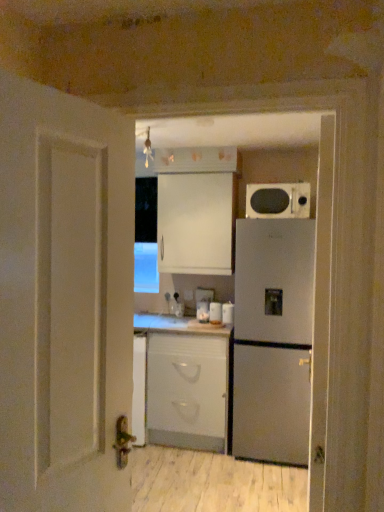
The width and height of the screenshot is (384, 512). Describe the element at coordinates (186, 382) in the screenshot. I see `white matte cabinet at center, which is the 1th cabinetry from bottom to top` at that location.

Find the location of `white glossy jar at center, the 1th appliance viewed from the left`. white glossy jar at center, the 1th appliance viewed from the left is located at coordinates (202, 311).

Image resolution: width=384 pixels, height=512 pixels. What do you see at coordinates (196, 223) in the screenshot?
I see `white matte cabinet at upper center, positioned as the first cabinetry in top-to-bottom order` at bounding box center [196, 223].

Where is `white glossy canister at center, which is counted as the 3th appliance, starting from the left`? white glossy canister at center, which is counted as the 3th appliance, starting from the left is located at coordinates (228, 313).

You are a GUI agent. You are given a task and a screenshot of the screen. Output one action in this format:
    pyautogui.click(x=<x>, y=<y>)
    Task: Click on the satin silver refrigerator at right
    
    Given the screenshot: What is the action you would take?
    pyautogui.click(x=273, y=339)

In the scene shown: Is white matte cabinet at upper center, arranged as the second cabinetry when ordered from the bottom, taller than white glossy canister at center, which is counted as the 3th appliance, starting from the left?

Yes, white matte cabinet at upper center, arranged as the second cabinetry when ordered from the bottom, is taller than white glossy canister at center, which is counted as the 3th appliance, starting from the left.

Is white matte cabinet at upper center, arranged as the second cabinetry when ordered from the bottom, to the right of white glossy canister at center, which is counted as the 3th appliance, starting from the left, from the viewer's perspective?

Incorrect, white matte cabinet at upper center, arranged as the second cabinetry when ordered from the bottom, is not on the right side of white glossy canister at center, which is counted as the 3th appliance, starting from the left.

Is white matte cabinet at upper center, positioned as the first cabinetry in top-to-bottom order, not near white glossy canister at center, which is the first appliance in right-to-left order?

That's not correct — white matte cabinet at upper center, positioned as the first cabinetry in top-to-bottom order, is a little close to white glossy canister at center, which is the first appliance in right-to-left order.

Would you say matte black microwave at upper right contains white glossy jar at center, the 1th appliance viewed from the left?

No, white glossy jar at center, the 1th appliance viewed from the left, is not surrounded by matte black microwave at upper right.

Between matte black microwave at upper right and white glossy jar at center, which is the third appliance in right-to-left order, which one has less height?

white glossy jar at center, which is the third appliance in right-to-left order.

Is matte black microwave at upper right oriented away from white glossy jar at center, the 1th appliance viewed from the left?

No, matte black microwave at upper right is not facing away from white glossy jar at center, the 1th appliance viewed from the left.

Is white matte cabinet at upper center, arranged as the second cabinetry when ordered from the bottom, smaller than matte black microwave at upper right?

No.

Does point (228, 234) come in front of point (291, 187)?

No, it is behind (291, 187).

From the image's perspective, which one is positioned higher, white matte cabinet at upper center, positioned as the first cabinetry in top-to-bottom order, or matte black microwave at upper right?

matte black microwave at upper right, from the image's perspective.

Considering the sizes of white matte cabinet at upper center, positioned as the first cabinetry in top-to-bottom order, and matte black microwave at upper right in the image, is white matte cabinet at upper center, positioned as the first cabinetry in top-to-bottom order, wider or thinner than matte black microwave at upper right?

In the image, white matte cabinet at upper center, positioned as the first cabinetry in top-to-bottom order, appears to be wider than matte black microwave at upper right.

Is white glossy jar at center, which is the third appliance in right-to-left order, not near satin silver refrigerator at right?

They are positioned close to each other.

Between white glossy jar at center, which is the third appliance in right-to-left order, and satin silver refrigerator at right, which one has less height?

Standing shorter between the two is white glossy jar at center, which is the third appliance in right-to-left order.

Is white glossy jar at center, which is the third appliance in right-to-left order, positioned beyond the bounds of satin silver refrigerator at right?

That's correct, white glossy jar at center, which is the third appliance in right-to-left order, is outside of satin silver refrigerator at right.

From the image's perspective, is white glossy jar at center, the 1th appliance viewed from the left, above or below satin silver refrigerator at right?

white glossy jar at center, the 1th appliance viewed from the left, is above satin silver refrigerator at right.

Between point (221, 411) and point (297, 186), which one is positioned in front?

The point (297, 186) is closer.

Does white matte cabinet at center, which is the 1th cabinetry from bottom to top, contain matte black microwave at upper right?

Definitely not — matte black microwave at upper right is not inside white matte cabinet at center, which is the 1th cabinetry from bottom to top.

The height and width of the screenshot is (512, 384). Identify the location of the 2nd cabinetry to the left of the matte black microwave at upper right, starting your count from the anchor. (186, 382).

What's the angular difference between white matte cabinet at center, which is the 1th cabinetry from bottom to top, and matte black microwave at upper right's facing directions?

The angle between the facing direction of white matte cabinet at center, which is the 1th cabinetry from bottom to top, and the facing direction of matte black microwave at upper right is 2.76 degrees.

Considering the relative sizes of white glossy jar at center, which is the third appliance in right-to-left order, and white glossy canister at center, which is the first appliance in right-to-left order, in the image provided, is white glossy jar at center, which is the third appliance in right-to-left order, bigger than white glossy canister at center, which is the first appliance in right-to-left order,?

Yes, white glossy jar at center, which is the third appliance in right-to-left order, is bigger than white glossy canister at center, which is the first appliance in right-to-left order.

Can you confirm if white glossy jar at center, the 1th appliance viewed from the left, is shorter than white glossy canister at center, which is the first appliance in right-to-left order?

No, white glossy jar at center, the 1th appliance viewed from the left, is not shorter than white glossy canister at center, which is the first appliance in right-to-left order.

Is white glossy jar at center, the 1th appliance viewed from the left, far from white glossy canister at center, which is the first appliance in right-to-left order?

No.

Is white glossy jar at center, which is the third appliance in right-to-left order, at the right side of white glossy canister at center, which is counted as the 3th appliance, starting from the left?

Incorrect, white glossy jar at center, which is the third appliance in right-to-left order, is not on the right side of white glossy canister at center, which is counted as the 3th appliance, starting from the left.

Consider the image. Which point is more forward, (213,191) or (218,313)?

The point (213,191) is in front.

Does white matte cabinet at upper center, positioned as the first cabinetry in top-to-bottom order, come behind white glossy jar at center, the 2th appliance positioned from the right?

No, it is in front of white glossy jar at center, the 2th appliance positioned from the right.

Which cabinetry is the 1st one when counting from the left side of the white glossy canister at center, which is counted as the 3th appliance, starting from the left? Please provide its 2D coordinates.

[(196, 223)]

Identify the location of appliance that is the 1st object directly below the matte black microwave at upper right (from a real-world perspective). pyautogui.click(x=202, y=311).

Looking at this image, based on their spatial positions, is white matte cabinet at center, which is the 1th cabinetry from bottom to top, or white matte cabinet at upper center, arranged as the second cabinetry when ordered from the bottom, closer to white glossy canister at center, which is counted as the 3th appliance, starting from the left?

The object closer to white glossy canister at center, which is counted as the 3th appliance, starting from the left, is white matte cabinet at center, which is the 1th cabinetry from bottom to top.

Considering their positions, is white glossy jar at center, marked as the 2th appliance in a left-to-right arrangement, positioned closer to satin silver refrigerator at right than matte black microwave at upper right?

matte black microwave at upper right is positioned closer to the anchor satin silver refrigerator at right.

Based on their spatial positions, is matte black microwave at upper right or white glossy canister at center, which is the first appliance in right-to-left order, closer to satin silver refrigerator at right?

white glossy canister at center, which is the first appliance in right-to-left order, is closer to satin silver refrigerator at right.

From the image, which object appears to be farther from white glossy jar at center, which is the third appliance in right-to-left order, white matte cabinet at center, which ranks as the 2th cabinetry in top-to-bottom order, or matte black microwave at upper right?

matte black microwave at upper right.

Looking at the image, which one is located closer to white matte cabinet at upper center, positioned as the first cabinetry in top-to-bottom order, white glossy jar at center, the 2th appliance positioned from the right, or matte black microwave at upper right?

matte black microwave at upper right.

When comparing their distances from white glossy canister at center, which is the first appliance in right-to-left order, does white glossy jar at center, which is the third appliance in right-to-left order, or satin silver refrigerator at right seem further?

satin silver refrigerator at right.

Consider the image. From the image, which object appears to be nearer to white glossy canister at center, which is the first appliance in right-to-left order, satin silver refrigerator at right or white matte cabinet at center, which is the 1th cabinetry from bottom to top?

Among the two, satin silver refrigerator at right is located nearer to white glossy canister at center, which is the first appliance in right-to-left order.

Which object lies nearer to the anchor point matte black microwave at upper right, satin silver refrigerator at right or white glossy jar at center, the 2th appliance positioned from the right?

Based on the image, satin silver refrigerator at right appears to be nearer to matte black microwave at upper right.

Identify the location of appliance between satin silver refrigerator at right and white glossy jar at center, the 2th appliance positioned from the right, in the front-back direction. (228, 313).

Locate an element on the screen. refrigerator between matte black microwave at upper right and white matte cabinet at center, which ranks as the 2th cabinetry in top-to-bottom order, from top to bottom is located at coordinates (273, 339).

You are a GUI agent. You are given a task and a screenshot of the screen. Output one action in this format:
    pyautogui.click(x=<x>, y=<y>)
    Task: Click on the cabinetry between matte black microwave at upper right and white glossy canister at center, which is counted as the 3th appliance, starting from the left, from top to bottom
    The image size is (384, 512).
    Given the screenshot: What is the action you would take?
    pyautogui.click(x=196, y=223)

What are the coordinates of `cabinetry that lies between matte black microwave at upper right and white matte cabinet at center, which is the 1th cabinetry from bottom to top, from top to bottom` in the screenshot? It's located at (196, 223).